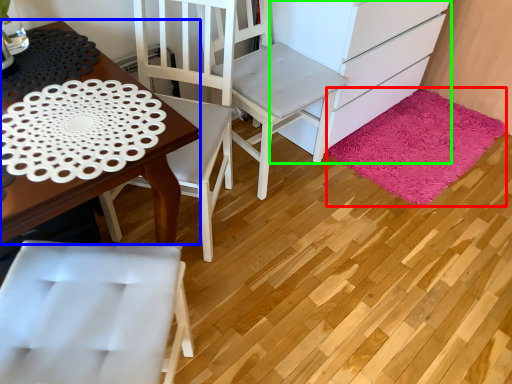
Question: Estimate the real-world distances between objects in this image. Which object is farther from mat (highlighted by a red box), desk (highlighted by a blue box) or cabinetry (highlighted by a green box)?

Choices:
 (A) desk
 (B) cabinetry

Answer: (A)